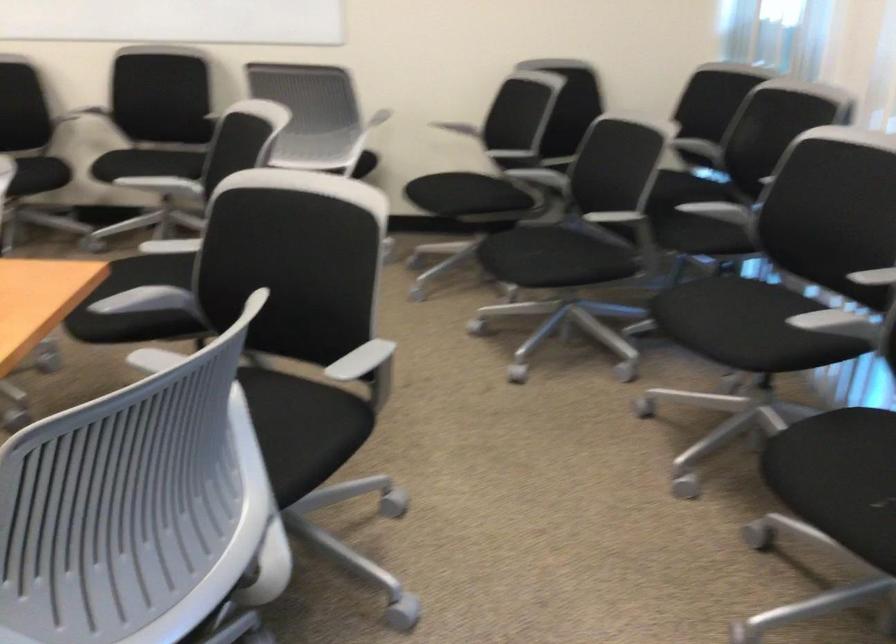
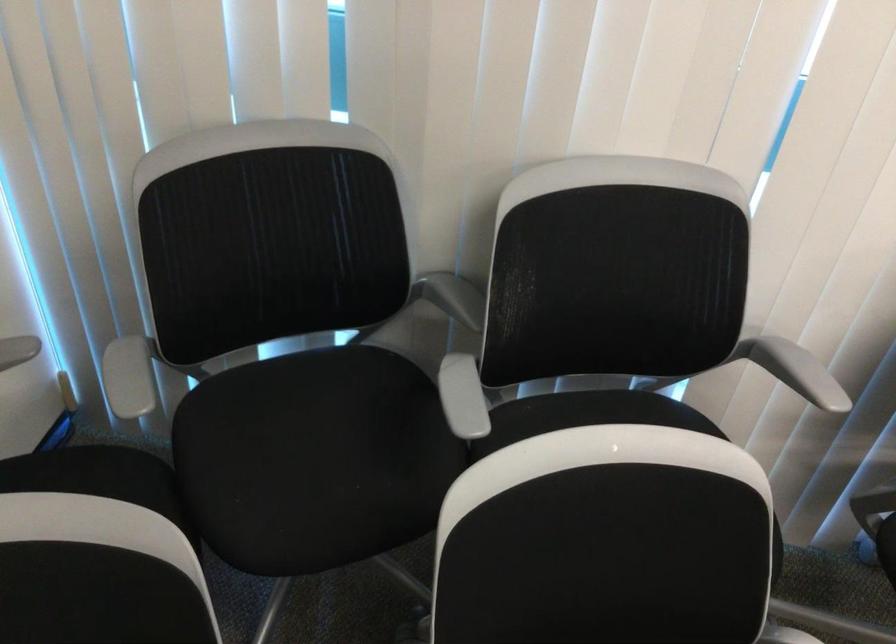
In the second image, find the point that corresponds to the point at 789,171 in the first image.

(794, 370)